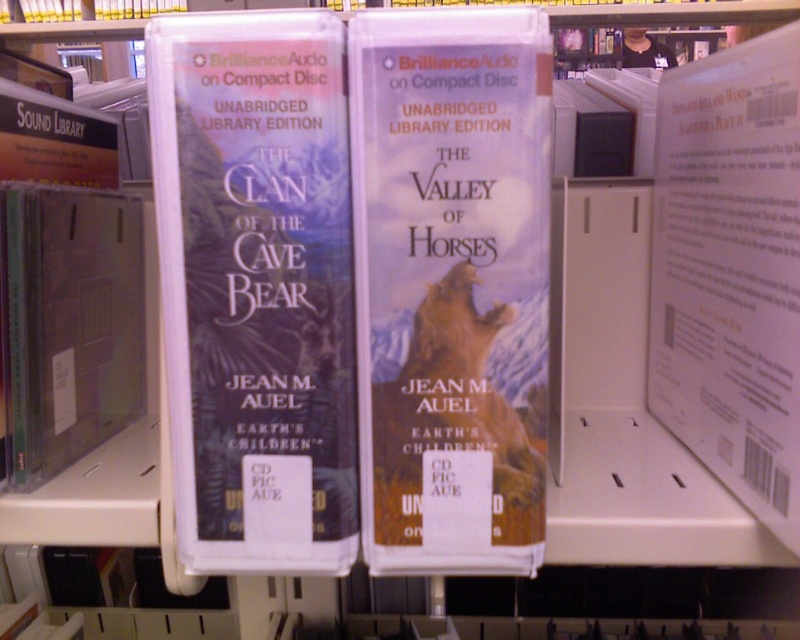
Between point (236, 531) and point (678, 202), which one is positioned behind?

Point (678, 202)

Between matte plastic book at center and white paper at upper right, which one is positioned higher?

white paper at upper right

Who is more distant from viewer, (254, 464) or (776, 320)?

The point (776, 320) is behind.

Find the location of a particular element. This screenshot has height=640, width=800. matte plastic book at center is located at coordinates (256, 288).

Is matte paper cover at center smaller than white paper at upper right?

Yes.

Who is more forward, (x=382, y=148) or (x=732, y=196)?

Positioned in front is point (x=382, y=148).

Find the location of a particular element. matte paper cover at center is located at coordinates (450, 285).

Does matte paper cover at center have a greater width compared to matte plastic book at center?

In fact, matte paper cover at center might be narrower than matte plastic book at center.

Can you confirm if matte paper cover at center is positioned above matte plastic book at center?

No, matte paper cover at center is not above matte plastic book at center.

Is point (444, 419) closer to camera compared to point (280, 138)?

No, (444, 419) is further to viewer.

In order to click on matte paper cover at center in this screenshot , I will do `click(450, 285)`.